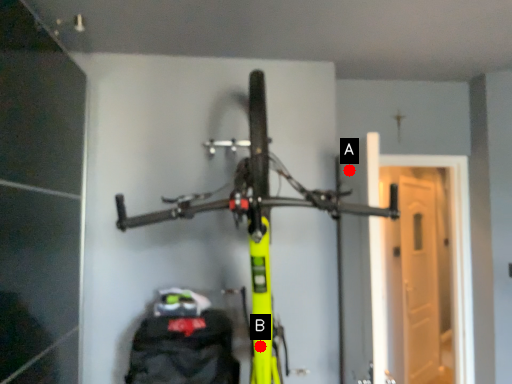
Question: Two points are circled on the image, labeled by A and B beside each circle. Which point is farther from the camera taking this photo?

Choices:
 (A) A is further
 (B) B is further

Answer: (A)